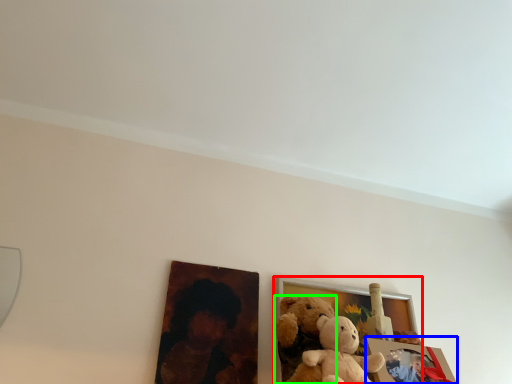
Question: Estimate the real-world distances between objects in this image. Which object is farther from picture frame (highlighted by a red box), picture frame (highlighted by a blue box) or teddy bear (highlighted by a green box)?

Choices:
 (A) picture frame
 (B) teddy bear

Answer: (A)